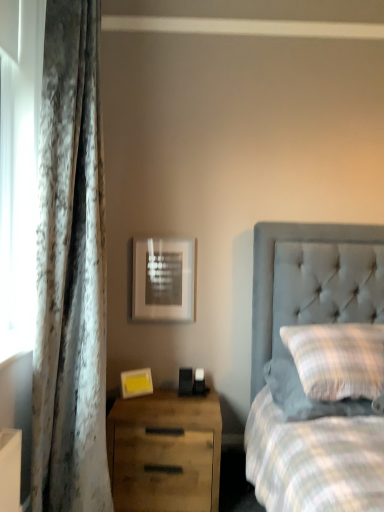
The width and height of the screenshot is (384, 512). What do you see at coordinates (70, 271) in the screenshot? I see `velvet curtain at left` at bounding box center [70, 271].

What do you see at coordinates (306, 395) in the screenshot? This screenshot has height=512, width=384. I see `plaid fabric pillow at right` at bounding box center [306, 395].

Find the location of a particular element. Image resolution: width=384 pixels, height=512 pixels. plaid fabric pillow at right is located at coordinates (306, 395).

At what (x,y) coordinates should I click in order to perform the action: click on yellow matte picture frame at lower left, acting as the second picture frame starting from the back. Please return your answer as a coordinate pair (x, y). Looking at the image, I should click on (136, 383).

Locate an element on the screen. This screenshot has height=512, width=384. drawer that appears behind the plaid fabric pillow at right is located at coordinates (162, 469).

Is wooden drawer at lower left situated inside plaid fabric pillow at right or outside?

wooden drawer at lower left is not enclosed by plaid fabric pillow at right.

In the scene shown: Who is taller, wooden drawer at lower left or plaid fabric pillow at right?

wooden drawer at lower left.

Looking at the image, does wooden drawer at lower left seem bigger or smaller compared to plaid fabric pillow at right?

wooden drawer at lower left is bigger than plaid fabric pillow at right.

Are yellow matte picture frame at lower left, acting as the first picture frame starting from the bottom, and wooden drawer at lower left making contact?

No, yellow matte picture frame at lower left, acting as the first picture frame starting from the bottom, is not touching wooden drawer at lower left.

Is point (139, 382) farther from camera compared to point (151, 442)?

Yes, it is.

Is yellow matte picture frame at lower left, arranged as the second picture frame when viewed from the top, in front of or behind wooden drawer at lower left in the image?

Visually, yellow matte picture frame at lower left, arranged as the second picture frame when viewed from the top, is located behind wooden drawer at lower left.

Starting from the wooden drawer at lower left, which picture frame is the 1st one behind? Please provide its 2D coordinates.

[(136, 383)]

Consider the image. From a real-world perspective, between plaid fabric pillow at right and velvet curtain at left, who is vertically higher?

In real-world perspective, velvet curtain at left is above.

From the picture: From their relative heights in the image, would you say plaid fabric pillow at right is taller or shorter than velvet curtain at left?

Considering their sizes, plaid fabric pillow at right has less height than velvet curtain at left.

From the image's perspective, is plaid fabric pillow at right positioned above or below velvet curtain at left?

plaid fabric pillow at right is situated lower than velvet curtain at left in the image.

Is plaid fabric pillow at right positioned with its back to velvet curtain at left?

No, plaid fabric pillow at right is not facing the opposite direction of velvet curtain at left.

What's the angular difference between velvet curtain at left and wooden drawer at lower left's facing directions?

There is a 90-degree angle between the facing directions of velvet curtain at left and wooden drawer at lower left.

Identify the location of drawer below the velvet curtain at left (from a real-world perspective). The height and width of the screenshot is (512, 384). (162, 469).

From the image's perspective, is velvet curtain at left positioned above or below wooden drawer at lower left?

velvet curtain at left is above wooden drawer at lower left.

Is velvet curtain at left looking in the opposite direction of wooden drawer at lower left?

No, velvet curtain at left is not facing away from wooden drawer at lower left.

Which is less distant, (146, 315) or (129, 372)?

Point (146, 315) appears to be farther away from the viewer than point (129, 372).

Is matte silver picture frame at upper center, which appears as the 2th picture frame when ordered from the bottom, far away from yellow matte picture frame at lower left, arranged as the second picture frame when viewed from the top?

matte silver picture frame at upper center, which appears as the 2th picture frame when ordered from the bottom, is actually quite close to yellow matte picture frame at lower left, arranged as the second picture frame when viewed from the top.

Which is more to the left, matte silver picture frame at upper center, which ranks as the 2th picture frame in front-to-back order, or yellow matte picture frame at lower left, acting as the first picture frame starting from the bottom?

yellow matte picture frame at lower left, acting as the first picture frame starting from the bottom.

From a real-world perspective, is matte silver picture frame at upper center, which ranks as the 2th picture frame in front-to-back order, positioned under yellow matte picture frame at lower left, arranged as the second picture frame when viewed from the top, based on gravity?

No, from a real-world perspective, matte silver picture frame at upper center, which ranks as the 2th picture frame in front-to-back order, is not under yellow matte picture frame at lower left, arranged as the second picture frame when viewed from the top.

Considering the relative sizes of plaid fabric pillow at right and wooden drawer at lower left in the image provided, is plaid fabric pillow at right bigger than wooden drawer at lower left?

No.

Can wooden drawer at lower left be found inside plaid fabric pillow at right?

That's incorrect, wooden drawer at lower left is not inside plaid fabric pillow at right.

From a real-world perspective, which object stands above the other?

From a 3D spatial view, plaid fabric pillow at right is above.

From the image's perspective, does matte silver picture frame at upper center, which ranks as the 2th picture frame in front-to-back order, appear lower than wooden drawer at lower left?

No.

Is point (147, 261) positioned behind point (192, 439)?

Yes, it is.

Is wooden drawer at lower left located within matte silver picture frame at upper center, the 1th picture frame in the back-to-front sequence?

No, wooden drawer at lower left is not inside matte silver picture frame at upper center, the 1th picture frame in the back-to-front sequence.

Can you tell me how much matte silver picture frame at upper center, the 1th picture frame when ordered from top to bottom, and wooden drawer at lower left differ in facing direction?

0.035 degrees.

The width and height of the screenshot is (384, 512). I want to click on pillow on the right of wooden drawer at lower left, so click(306, 395).

The height and width of the screenshot is (512, 384). Find the location of `the 1st picture frame above when counting from the wooden drawer at lower left (from the image's perspective)`. the 1st picture frame above when counting from the wooden drawer at lower left (from the image's perspective) is located at coordinates (136, 383).

From the image, which object appears to be nearer to yellow matte picture frame at lower left, acting as the first picture frame starting from the bottom, plaid fabric pillow at right or wooden drawer at lower left?

wooden drawer at lower left is positioned closer to the anchor yellow matte picture frame at lower left, acting as the first picture frame starting from the bottom.

Estimate the real-world distances between objects in this image. Which object is further from plaid fabric pillow at right, yellow matte picture frame at lower left, arranged as the second picture frame when viewed from the top, or wooden drawer at lower left?

Based on the image, yellow matte picture frame at lower left, arranged as the second picture frame when viewed from the top, appears to be further to plaid fabric pillow at right.

Looking at this image, based on their spatial positions, is matte silver picture frame at upper center, which appears as the 2th picture frame when ordered from the bottom, or yellow matte picture frame at lower left, acting as the first picture frame starting from the bottom, further from wooden drawer at lower left?

The object further to wooden drawer at lower left is matte silver picture frame at upper center, which appears as the 2th picture frame when ordered from the bottom.

When comparing their distances from matte silver picture frame at upper center, which appears as the 2th picture frame when ordered from the bottom, does yellow matte picture frame at lower left, acting as the second picture frame starting from the back, or plaid fabric pillow at right seem closer?

yellow matte picture frame at lower left, acting as the second picture frame starting from the back, is positioned closer to the anchor matte silver picture frame at upper center, which appears as the 2th picture frame when ordered from the bottom.

When comparing their distances from matte silver picture frame at upper center, the 1th picture frame in the back-to-front sequence, does plaid fabric pillow at right or wooden drawer at lower left seem closer?

Among the two, plaid fabric pillow at right is located nearer to matte silver picture frame at upper center, the 1th picture frame in the back-to-front sequence.

From the image, which object appears to be farther from velvet curtain at left, plaid fabric pillow at right or wooden drawer at lower left?

plaid fabric pillow at right is positioned further to the anchor velvet curtain at left.

Which object lies further to the anchor point velvet curtain at left, matte silver picture frame at upper center, which ranks as the 2th picture frame in front-to-back order, or yellow matte picture frame at lower left, arranged as the second picture frame when viewed from the top?

The object further to velvet curtain at left is yellow matte picture frame at lower left, arranged as the second picture frame when viewed from the top.

Which object lies nearer to the anchor point yellow matte picture frame at lower left, arranged as the 1th picture frame when viewed from the front, velvet curtain at left or wooden drawer at lower left?

The object closer to yellow matte picture frame at lower left, arranged as the 1th picture frame when viewed from the front, is wooden drawer at lower left.

Where is `drawer situated between matte silver picture frame at upper center, the 1th picture frame in the back-to-front sequence, and plaid fabric pillow at right from left to right`? Image resolution: width=384 pixels, height=512 pixels. drawer situated between matte silver picture frame at upper center, the 1th picture frame in the back-to-front sequence, and plaid fabric pillow at right from left to right is located at coordinates (162, 469).

You are a GUI agent. You are given a task and a screenshot of the screen. Output one action in this format:
    pyautogui.click(x=<x>, y=<y>)
    Task: Click on the picture frame situated between yellow matte picture frame at lower left, arranged as the 1th picture frame when viewed from the front, and plaid fabric pillow at right from left to right
    This screenshot has height=512, width=384.
    Given the screenshot: What is the action you would take?
    pyautogui.click(x=164, y=279)

Locate an element on the screen. Image resolution: width=384 pixels, height=512 pixels. drawer situated between velvet curtain at left and plaid fabric pillow at right from left to right is located at coordinates (162, 469).

The width and height of the screenshot is (384, 512). I want to click on drawer situated between yellow matte picture frame at lower left, arranged as the 1th picture frame when viewed from the front, and plaid fabric pillow at right from left to right, so click(x=162, y=469).